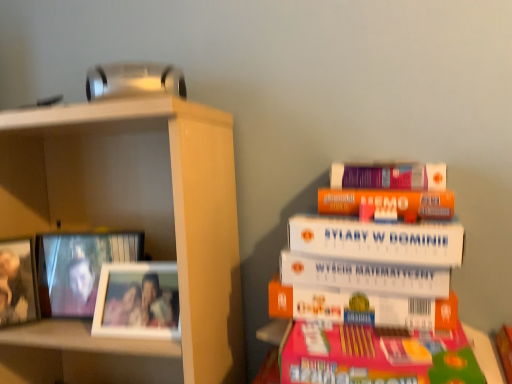
Question: From the image's perspective, is white matte picture frame at left, positioned as the first picture frame in right-to-left order, positioned above or below metallic silver picture frame at left, acting as the 3th picture frame starting from the right?

Choices:
 (A) above
 (B) below

Answer: (B)

Question: Is white matte picture frame at left, which is counted as the 3th picture frame, starting from the left, wider or thinner than metallic silver picture frame at left, positioned as the 1th picture frame in left-to-right order?

Choices:
 (A) wide
 (B) thin

Answer: (B)

Question: Which object is positioned farthest from the white matte book at upper right?

Choices:
 (A) wooden photo frame at left, which is counted as the second picture frame, starting from the left
 (B) metallic silver picture frame at left, acting as the 3th picture frame starting from the right
 (C) white matte picture frame at left, positioned as the first picture frame in right-to-left order

Answer: (B)

Question: Estimate the real-world distances between objects in this image. Which object is farther from the white matte picture frame at left, positioned as the first picture frame in right-to-left order?

Choices:
 (A) metallic silver picture frame at left, positioned as the 1th picture frame in left-to-right order
 (B) white matte book at upper right
 (C) wooden photo frame at left, which is counted as the second picture frame, starting from the left

Answer: (B)